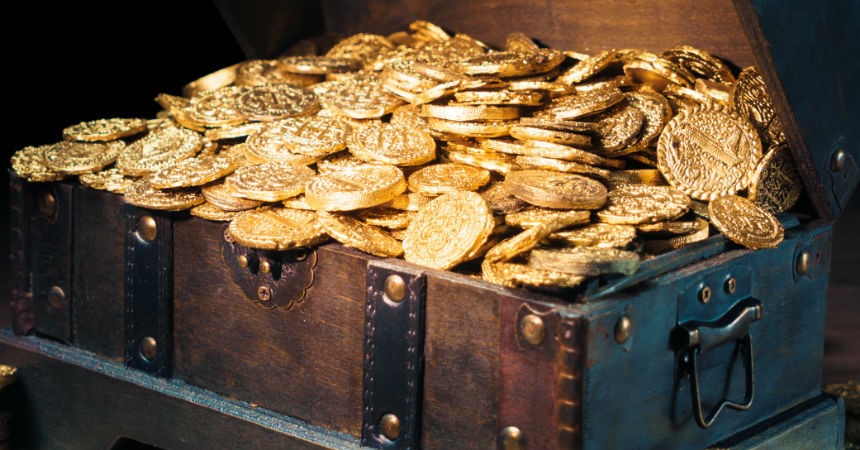
At what (x,y) coordinates should I click in order to perform the action: click on wooden trunk. Please return your answer as a coordinate pair (x, y). This screenshot has width=860, height=450. Looking at the image, I should click on 274,345.